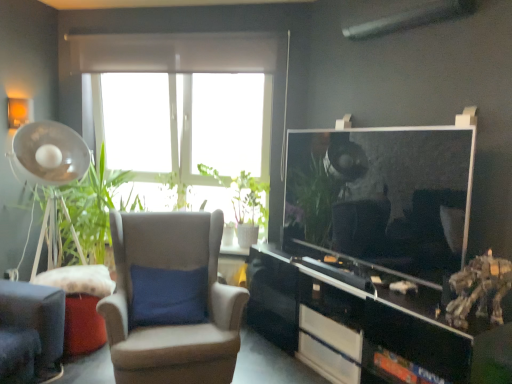
Question: Does white glossy drawer at lower center, which ranks as the 2th drawer in bottom-to-top order, lie in front of white glossy drawer at lower center, placed as the 2th drawer when sorted from top to bottom?

Choices:
 (A) yes
 (B) no

Answer: (A)

Question: Is white glossy drawer at lower center, which ranks as the 2th drawer in bottom-to-top order, outside of white glossy drawer at lower center, placed as the first drawer when sorted from bottom to top?

Choices:
 (A) no
 (B) yes

Answer: (B)

Question: Considering the relative sizes of white glossy drawer at lower center, which is the 1th drawer in top-to-bottom order, and white glossy drawer at lower center, placed as the 2th drawer when sorted from top to bottom, in the image provided, is white glossy drawer at lower center, which is the 1th drawer in top-to-bottom order, thinner than white glossy drawer at lower center, placed as the 2th drawer when sorted from top to bottom,?

Choices:
 (A) yes
 (B) no

Answer: (B)

Question: Is white glossy drawer at lower center, which ranks as the 2th drawer in bottom-to-top order, oriented towards white glossy drawer at lower center, placed as the first drawer when sorted from bottom to top?

Choices:
 (A) no
 (B) yes

Answer: (A)

Question: Is white glossy drawer at lower center, which is the 1th drawer in top-to-bottom order, wider than white glossy drawer at lower center, placed as the 2th drawer when sorted from top to bottom?

Choices:
 (A) no
 (B) yes

Answer: (B)

Question: Considering the relative sizes of white glossy drawer at lower center, which ranks as the 2th drawer in bottom-to-top order, and white glossy drawer at lower center, placed as the first drawer when sorted from bottom to top, in the image provided, is white glossy drawer at lower center, which ranks as the 2th drawer in bottom-to-top order, shorter than white glossy drawer at lower center, placed as the first drawer when sorted from bottom to top,?

Choices:
 (A) yes
 (B) no

Answer: (B)

Question: Can you confirm if suede wingback chair at center is bigger than white glossy drawer at lower center, placed as the 2th drawer when sorted from top to bottom?

Choices:
 (A) no
 (B) yes

Answer: (B)

Question: Is suede wingback chair at center taller than white glossy drawer at lower center, placed as the first drawer when sorted from bottom to top?

Choices:
 (A) yes
 (B) no

Answer: (A)

Question: Considering the relative positions of suede wingback chair at center and white glossy drawer at lower center, placed as the 2th drawer when sorted from top to bottom, in the image provided, is suede wingback chair at center to the left of white glossy drawer at lower center, placed as the 2th drawer when sorted from top to bottom, from the viewer's perspective?

Choices:
 (A) no
 (B) yes

Answer: (B)

Question: Is suede wingback chair at center aimed at white glossy drawer at lower center, placed as the first drawer when sorted from bottom to top?

Choices:
 (A) no
 (B) yes

Answer: (A)

Question: Is suede wingback chair at center further to the viewer compared to white glossy drawer at lower center, placed as the 2th drawer when sorted from top to bottom?

Choices:
 (A) yes
 (B) no

Answer: (B)

Question: Is suede wingback chair at center directly adjacent to white glossy drawer at lower center, placed as the first drawer when sorted from bottom to top?

Choices:
 (A) yes
 (B) no

Answer: (B)

Question: Could you tell me if black glossy cabinet at lower right is facing white glossy drawer at lower center, which is the 1th drawer in top-to-bottom order?

Choices:
 (A) no
 (B) yes

Answer: (B)